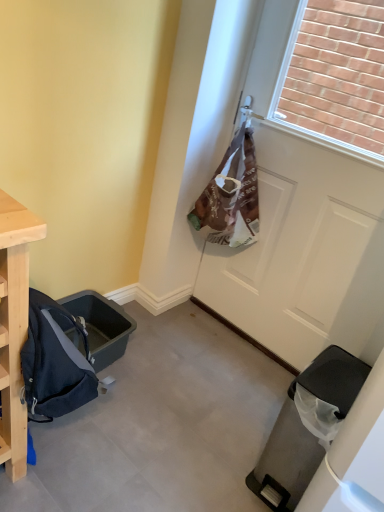
Identify the location of free space to the back side of black plastic trash can at lower right. (253, 404).